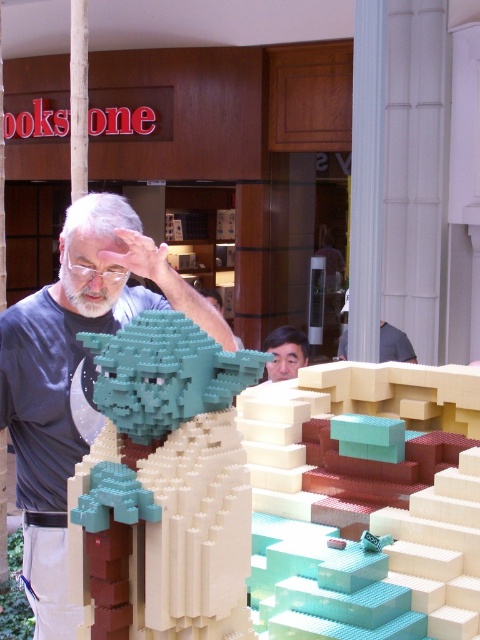
Question: Does teal matte lego figure at center lie behind smooth skin face at center?

Choices:
 (A) yes
 (B) no

Answer: (B)

Question: Which of these objects is positioned farthest from the teal matte lego figure at center?

Choices:
 (A) matte gray shirt at center
 (B) smooth skin face at center

Answer: (B)

Question: Based on their relative distances, which object is farther from the matte gray shirt at center?

Choices:
 (A) teal matte lego figure at center
 (B) smooth skin face at center

Answer: (B)

Question: Is teal matte lego figure at center wider than matte gray shirt at center?

Choices:
 (A) yes
 (B) no

Answer: (B)

Question: Does matte gray shirt at center appear over smooth skin face at center?

Choices:
 (A) yes
 (B) no

Answer: (B)

Question: Which of these objects is positioned closest to the smooth skin face at center?

Choices:
 (A) matte gray shirt at center
 (B) teal matte lego figure at center

Answer: (A)